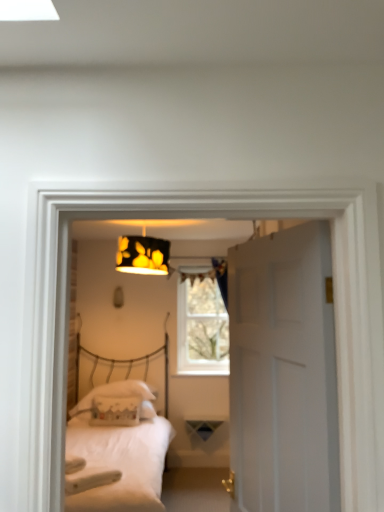
The height and width of the screenshot is (512, 384). Describe the element at coordinates (143, 255) in the screenshot. I see `black paper lampshade at upper center` at that location.

Identify the location of clear glass window at center. (201, 325).

You are a GUI agent. You are given a task and a screenshot of the screen. Output one action in this format:
    pyautogui.click(x=<x>, y=<y>)
    Task: Click on the white fabric pillow at center, marked as the second pillow in a front-to-back arrangement
    The width and height of the screenshot is (384, 512).
    Given the screenshot: What is the action you would take?
    pyautogui.click(x=118, y=393)

What do you see at coordinates (115, 411) in the screenshot?
I see `white fabric pillow at center, the second pillow in the back-to-front sequence` at bounding box center [115, 411].

This screenshot has width=384, height=512. What are the coordinates of `white matte door at center` in the screenshot? It's located at (283, 372).

Would you say black paper lampshade at upper center is inside or outside clear glass window at center?

black paper lampshade at upper center cannot be found inside clear glass window at center.

From the picture: From the image's perspective, is black paper lampshade at upper center under clear glass window at center?

No, from the image's perspective, black paper lampshade at upper center is not below clear glass window at center.

Considering the relative sizes of black paper lampshade at upper center and clear glass window at center in the image provided, is black paper lampshade at upper center taller than clear glass window at center?

No, black paper lampshade at upper center is not taller than clear glass window at center.

Considering the relative sizes of black paper lampshade at upper center and clear glass window at center in the image provided, is black paper lampshade at upper center wider than clear glass window at center?

Yes.

From a real-world perspective, which object rests below the other?

white matte bed at center is physically lower.

Does white matte bed at center turn towards white matte door at center?

No, white matte bed at center does not turn towards white matte door at center.

From the image's perspective, is white matte bed at center above or below white matte door at center?

Based on their image positions, white matte bed at center is located beneath white matte door at center.

Considering the sizes of objects white matte bed at center and white matte door at center in the image provided, who is bigger, white matte bed at center or white matte door at center?

white matte bed at center.

Is white fabric pillow at center, marked as the second pillow in a front-to-back arrangement, in contact with white matte door at center?

They are not placed beside each other.

Is white matte door at center a part of white fabric pillow at center, marked as the second pillow in a front-to-back arrangement?

No, white matte door at center is not inside white fabric pillow at center, marked as the second pillow in a front-to-back arrangement.

Does white fabric pillow at center, marked as the second pillow in a front-to-back arrangement, have a lesser width compared to white matte door at center?

Incorrect, the width of white fabric pillow at center, marked as the second pillow in a front-to-back arrangement, is not less than that of white matte door at center.

In the scene shown: Considering the positions of objects white fabric pillow at center, the 1th pillow when ordered from back to front, and white matte door at center in the image provided, who is in front, white fabric pillow at center, the 1th pillow when ordered from back to front, or white matte door at center?

Positioned in front is white matte door at center.

From the image's perspective, is clear glass window at center positioned above or below white matte bed at center?

Based on their image positions, clear glass window at center is located above white matte bed at center.

Does clear glass window at center turn towards white matte bed at center?

No, clear glass window at center does not turn towards white matte bed at center.

Can you confirm if clear glass window at center is smaller than white matte bed at center?

Yes, clear glass window at center is smaller than white matte bed at center.

Looking at their sizes, would you say clear glass window at center is wider or thinner than white matte bed at center?

clear glass window at center is thinner than white matte bed at center.

Is white matte door at center situated inside white matte bed at center or outside?

white matte door at center is outside white matte bed at center.

Considering the positions of objects white matte door at center and white matte bed at center in the image provided, who is more to the left, white matte door at center or white matte bed at center?

white matte bed at center.

Which object is further away from the camera taking this photo, white matte door at center or white matte bed at center?

white matte bed at center is more distant.

What are the coordinates of `door lying above the white matte bed at center (from the image's perspective)` in the screenshot? It's located at (283, 372).

Is clear glass window at center positioned beyond the bounds of black paper lampshade at upper center?

Absolutely, clear glass window at center is external to black paper lampshade at upper center.

Is clear glass window at center touching black paper lampshade at upper center?

There is a gap between clear glass window at center and black paper lampshade at upper center.

Is clear glass window at center thinner than black paper lampshade at upper center?

Correct, the width of clear glass window at center is less than that of black paper lampshade at upper center.

Between clear glass window at center and black paper lampshade at upper center, which one is positioned behind?

Positioned behind is clear glass window at center.

Could you tell me if white fabric pillow at center, the second pillow in the back-to-front sequence, is facing clear glass window at center?

No, white fabric pillow at center, the second pillow in the back-to-front sequence, is not oriented towards clear glass window at center.

From the image's perspective, which one is positioned lower, white fabric pillow at center, the first pillow from the front, or clear glass window at center?

white fabric pillow at center, the first pillow from the front, is shown below in the image.

From a real-world perspective, is white fabric pillow at center, the first pillow from the front, positioned above or below clear glass window at center?

white fabric pillow at center, the first pillow from the front, is below clear glass window at center.

I want to click on lamp positioned vertically above the clear glass window at center (from a real-world perspective), so click(x=143, y=255).

Find the location of a particular element. bed behind the white matte door at center is located at coordinates (121, 446).

Considering their positions, is clear glass window at center positioned closer to white matte bed at center than white fabric pillow at center, the 1th pillow when ordered from back to front?

The object closer to white matte bed at center is white fabric pillow at center, the 1th pillow when ordered from back to front.

From the image, which object appears to be nearer to white matte bed at center, clear glass window at center or white matte door at center?

clear glass window at center.

Estimate the real-world distances between objects in this image. Which object is closer to clear glass window at center, white matte door at center or white matte bed at center?

white matte bed at center is closer to clear glass window at center.

Estimate the real-world distances between objects in this image. Which object is further from clear glass window at center, white fabric pillow at center, marked as the second pillow in a front-to-back arrangement, or white matte door at center?

The object further to clear glass window at center is white matte door at center.

Considering their positions, is white matte bed at center positioned closer to black paper lampshade at upper center than white fabric pillow at center, marked as the second pillow in a front-to-back arrangement?

white matte bed at center is positioned closer to the anchor black paper lampshade at upper center.

In the scene shown: Considering their positions, is white matte door at center positioned closer to white fabric pillow at center, the 1th pillow when ordered from back to front, than black paper lampshade at upper center?

black paper lampshade at upper center is closer to white fabric pillow at center, the 1th pillow when ordered from back to front.

Considering their positions, is white fabric pillow at center, the first pillow from the front, positioned closer to white fabric pillow at center, the 1th pillow when ordered from back to front, than white matte door at center?

Based on the image, white fabric pillow at center, the first pillow from the front, appears to be nearer to white fabric pillow at center, the 1th pillow when ordered from back to front.

Considering their positions, is white fabric pillow at center, marked as the second pillow in a front-to-back arrangement, positioned closer to clear glass window at center than white matte bed at center?

white fabric pillow at center, marked as the second pillow in a front-to-back arrangement, is positioned closer to the anchor clear glass window at center.

The image size is (384, 512). I want to click on bed between white matte door at center and white fabric pillow at center, the 1th pillow when ordered from back to front, in the front-back direction, so click(121, 446).

The width and height of the screenshot is (384, 512). I want to click on lamp positioned between white matte door at center and clear glass window at center from near to far, so click(x=143, y=255).

At what (x,y) coordinates should I click in order to perform the action: click on bed between white matte door at center and white fabric pillow at center, the first pillow from the front, along the z-axis. Please return your answer as a coordinate pair (x, y). This screenshot has height=512, width=384. Looking at the image, I should click on (121, 446).

Where is `bed between black paper lampshade at upper center and white fabric pillow at center, the second pillow in the back-to-front sequence, vertically`? The height and width of the screenshot is (512, 384). bed between black paper lampshade at upper center and white fabric pillow at center, the second pillow in the back-to-front sequence, vertically is located at coordinates (121, 446).